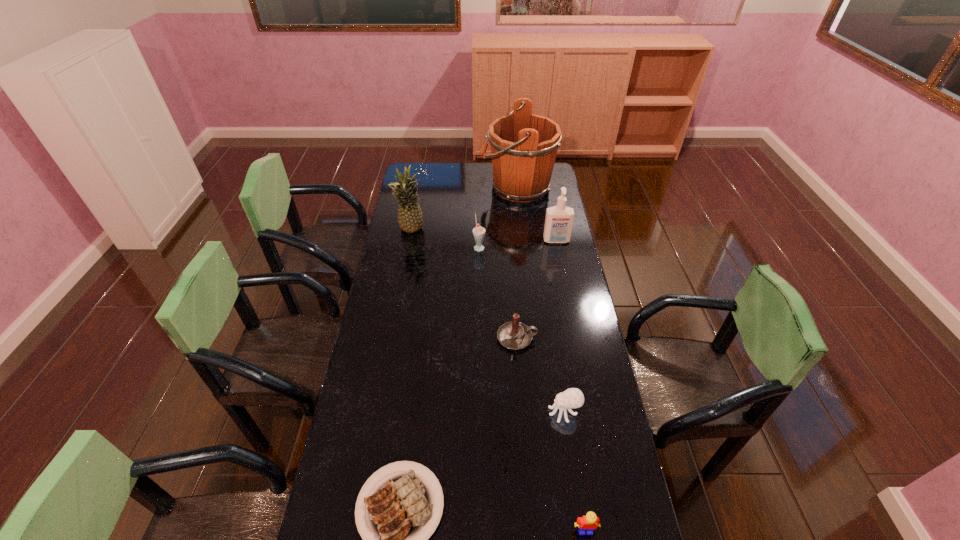
At what (x,y) coordinates should I click in order to perform the action: click on bucket positioned at the right edge. Please return your answer as a coordinate pair (x, y). The height and width of the screenshot is (540, 960). Looking at the image, I should click on (524, 146).

Locate an element on the screen. This screenshot has width=960, height=540. cleansing agent that is at the right edge is located at coordinates (559, 219).

Find the location of a particular element. This screenshot has width=960, height=540. octopus that is at the right edge is located at coordinates (573, 397).

The image size is (960, 540). In order to click on Lego positioned at the right edge in this screenshot , I will do click(x=589, y=522).

Where is `object present at the far right corner`? The height and width of the screenshot is (540, 960). object present at the far right corner is located at coordinates (524, 146).

Locate an element on the screen. The width and height of the screenshot is (960, 540). vacant area at the far edge of the desktop is located at coordinates (490, 173).

Find the location of a particular element. Image resolution: width=960 pixels, height=540 pixels. free location at the left edge is located at coordinates click(x=400, y=397).

Where is `vacant space at the right edge`? The image size is (960, 540). vacant space at the right edge is located at coordinates (549, 295).

Find the location of a particular element. vacant region at the far left corner of the desktop is located at coordinates (424, 168).

I want to click on vacant space that is in between the third tallest object and the candle, so click(537, 289).